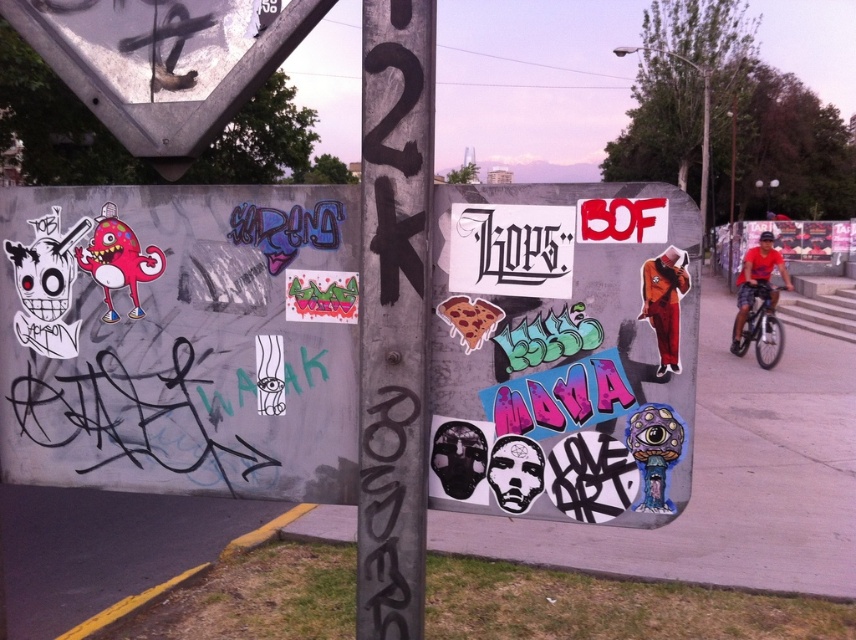
Which of these two, white paper stickers at center or black painted pole at center, stands taller?

With more height is black painted pole at center.

Does point (633, 337) come closer to viewer compared to point (381, 58)?

No, (633, 337) is behind (381, 58).

Between point (586, 480) and point (360, 378), which one is positioned behind?

Point (360, 378)

Locate an element on the screen. This screenshot has height=640, width=856. white paper stickers at center is located at coordinates (563, 349).